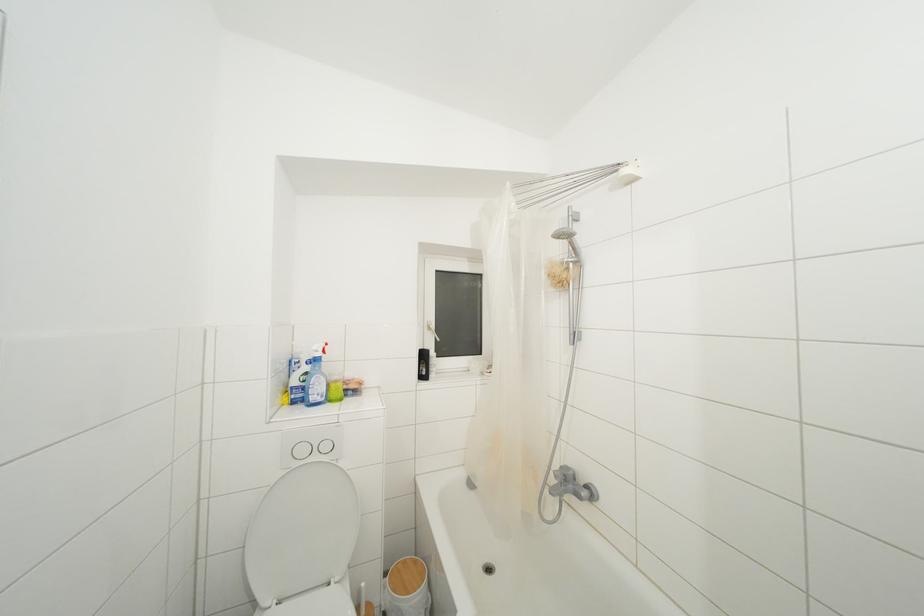
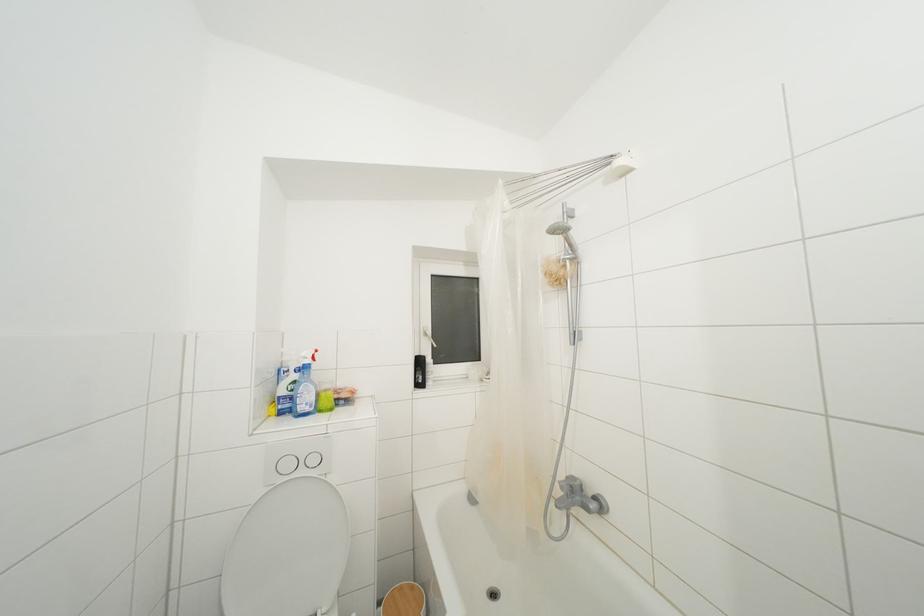
In a continuous first-person perspective shot, in which direction is the camera moving?

The cameraman walked toward right, forward.